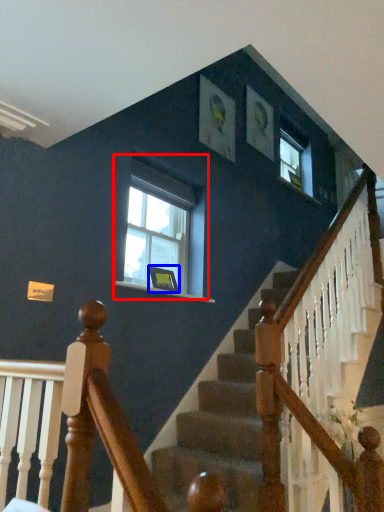
Question: Which point is further to the camera, window (highlighted by a red box) or picture frame (highlighted by a blue box)?

Choices:
 (A) window
 (B) picture frame

Answer: (B)